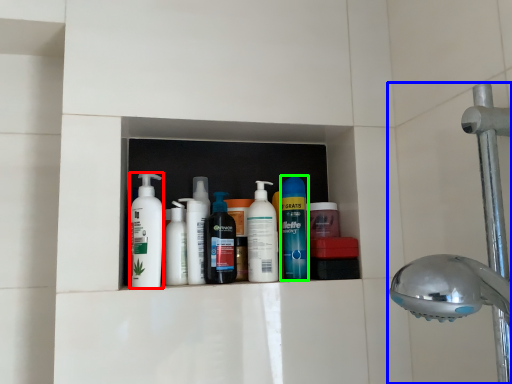
Question: Which is nearer to the cleaning product (highlighted by a red box)? shower (highlighted by a blue box) or cleaning product (highlighted by a green box).

Choices:
 (A) shower
 (B) cleaning product

Answer: (B)